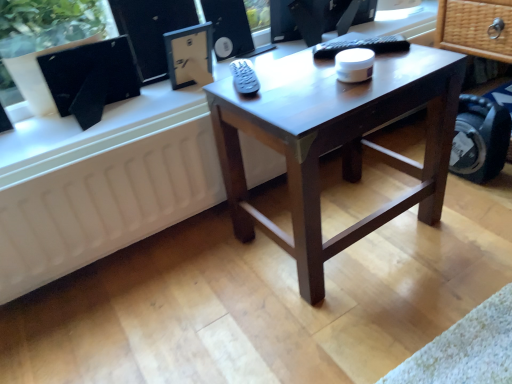
The height and width of the screenshot is (384, 512). What do you see at coordinates (338, 146) in the screenshot?
I see `matte dark brown coffee table at center` at bounding box center [338, 146].

The width and height of the screenshot is (512, 384). What do you see at coordinates (229, 28) in the screenshot? I see `matte black speaker at upper center` at bounding box center [229, 28].

The height and width of the screenshot is (384, 512). What do you see at coordinates (90, 78) in the screenshot?
I see `black matte computer monitor at upper left` at bounding box center [90, 78].

Identify the location of white matte radiator at lower left. (105, 203).

Looking at this image, could you measure the distance between black matte computer monitor at upper left and matte black speaker at upper center?

black matte computer monitor at upper left is 15.42 inches away from matte black speaker at upper center.

Between black matte computer monitor at upper left and matte black speaker at upper center, which one has smaller width?

With smaller width is matte black speaker at upper center.

Locate an element on the screen. This screenshot has width=512, height=384. speaker behind the black matte computer monitor at upper left is located at coordinates (229, 28).

Which of these two, black matte computer monitor at upper left or matte black speaker at upper center, stands shorter?

With less height is black matte computer monitor at upper left.

Is matte black speaker at upper center positioned with its back to matte dark brown coffee table at center?

That's not correct — matte black speaker at upper center is not looking away from matte dark brown coffee table at center.

Between matte black speaker at upper center and matte dark brown coffee table at center, which one has larger size?

With larger size is matte dark brown coffee table at center.

Would you consider matte black speaker at upper center to be distant from matte dark brown coffee table at center?

matte black speaker at upper center is near matte dark brown coffee table at center, not far away.

Does matte black speaker at upper center appear on the right side of matte dark brown coffee table at center?

In fact, matte black speaker at upper center is to the left of matte dark brown coffee table at center.

Which is behind, point (89, 175) or point (105, 61)?

The point (105, 61) is farther.

From a real-world perspective, is white matte radiator at lower left positioned above or below black matte computer monitor at upper left?

From a real-world perspective, white matte radiator at lower left is physically below black matte computer monitor at upper left.

You are a GUI agent. You are given a task and a screenshot of the screen. Output one action in this format:
    pyautogui.click(x=<x>, y=<y>)
    Task: Click on the radiator in front of the black matte computer monitor at upper left
    This screenshot has width=512, height=384.
    Given the screenshot: What is the action you would take?
    pyautogui.click(x=105, y=203)

Which of these two, white matte radiator at lower left or black matte computer monitor at upper left, stands shorter?

black matte computer monitor at upper left is shorter.

In the image, is matte dark brown coffee table at center positioned in front of or behind white matte radiator at lower left?

matte dark brown coffee table at center is positioned closer to the viewer than white matte radiator at lower left.

Is matte dark brown coffee table at center aimed at white matte radiator at lower left?

No, matte dark brown coffee table at center is not oriented towards white matte radiator at lower left.

Is matte dark brown coffee table at center wider than white matte radiator at lower left?

Indeed, matte dark brown coffee table at center has a greater width compared to white matte radiator at lower left.

Considering the relative sizes of matte dark brown coffee table at center and white matte radiator at lower left in the image provided, is matte dark brown coffee table at center bigger than white matte radiator at lower left?

Yes.

Is white matte radiator at lower left not close to matte black speaker at upper center?

That's not correct — white matte radiator at lower left is a little close to matte black speaker at upper center.

Considering the sizes of objects white matte radiator at lower left and matte black speaker at upper center in the image provided, who is wider, white matte radiator at lower left or matte black speaker at upper center?

matte black speaker at upper center.

Can you confirm if white matte radiator at lower left is taller than matte black speaker at upper center?

Correct, white matte radiator at lower left is much taller as matte black speaker at upper center.

Which is closer to the camera, (14, 246) or (207, 16)?

Point (14, 246).

Which is closer to the camera, (244, 21) or (200, 144)?

Clearly, point (244, 21) is more distant from the camera than point (200, 144).

Is matte black speaker at upper center surrounding white matte radiator at lower left?

No.

Measure the distance from matte black speaker at upper center to white matte radiator at lower left.

The distance of matte black speaker at upper center from white matte radiator at lower left is 53.90 centimeters.

From a real-world perspective, is matte black speaker at upper center physically below white matte radiator at lower left?

No, from a real-world perspective, matte black speaker at upper center is not under white matte radiator at lower left.

Is the depth of black matte computer monitor at upper left greater than that of white matte radiator at lower left?

Yes, black matte computer monitor at upper left is behind white matte radiator at lower left.

At what (x,y) coordinates should I click in order to perform the action: click on computer monitor located above the white matte radiator at lower left (from a real-world perspective). Please return your answer as a coordinate pair (x, y). This screenshot has width=512, height=384. Looking at the image, I should click on (90, 78).

Are black matte computer monitor at upper left and white matte radiator at lower left beside each other?

No, black matte computer monitor at upper left is not next to white matte radiator at lower left.

From the picture: Considering the relative positions of black matte computer monitor at upper left and white matte radiator at lower left in the image provided, is black matte computer monitor at upper left to the left or to the right of white matte radiator at lower left?

Clearly, black matte computer monitor at upper left is on the left of white matte radiator at lower left in the image.

The height and width of the screenshot is (384, 512). Identify the location of speaker above the black matte computer monitor at upper left (from the image's perspective). (229, 28).

Image resolution: width=512 pixels, height=384 pixels. Find the location of `speaker above the matte dark brown coffee table at center (from a real-world perspective)`. speaker above the matte dark brown coffee table at center (from a real-world perspective) is located at coordinates (229, 28).

Looking at the image, which one is located closer to white matte radiator at lower left, black matte computer monitor at upper left or matte black speaker at upper center?

Based on the image, black matte computer monitor at upper left appears to be nearer to white matte radiator at lower left.

Which object lies further to the anchor point matte dark brown coffee table at center, black matte computer monitor at upper left or white matte radiator at lower left?

black matte computer monitor at upper left is further to matte dark brown coffee table at center.

Which object lies further to the anchor point black matte computer monitor at upper left, white matte radiator at lower left or matte black speaker at upper center?

Among the two, matte black speaker at upper center is located further to black matte computer monitor at upper left.

From the image, which object appears to be farther from white matte radiator at lower left, black matte computer monitor at upper left or matte dark brown coffee table at center?

Among the two, matte dark brown coffee table at center is located further to white matte radiator at lower left.

Considering their positions, is black matte computer monitor at upper left positioned further to matte black speaker at upper center than matte dark brown coffee table at center?

Based on the image, matte dark brown coffee table at center appears to be further to matte black speaker at upper center.

Considering their positions, is matte dark brown coffee table at center positioned further to white matte radiator at lower left than black matte computer monitor at upper left?

Based on the image, matte dark brown coffee table at center appears to be further to white matte radiator at lower left.

Estimate the real-world distances between objects in this image. Which object is further from matte dark brown coffee table at center, matte black speaker at upper center or white matte radiator at lower left?

matte black speaker at upper center.

From the image, which object appears to be farther from matte black speaker at upper center, matte dark brown coffee table at center or black matte computer monitor at upper left?

Based on the image, matte dark brown coffee table at center appears to be further to matte black speaker at upper center.

Where is `radiator between black matte computer monitor at upper left and matte dark brown coffee table at center from left to right`? radiator between black matte computer monitor at upper left and matte dark brown coffee table at center from left to right is located at coordinates (105, 203).

Find the location of a particular element. This screenshot has width=512, height=384. coffee table that lies between matte black speaker at upper center and white matte radiator at lower left from top to bottom is located at coordinates (338, 146).

Identify the location of computer monitor that lies between matte black speaker at upper center and white matte radiator at lower left from top to bottom. point(90,78).

Find the location of a particular element. This screenshot has width=512, height=384. speaker located between black matte computer monitor at upper left and matte dark brown coffee table at center in the left-right direction is located at coordinates coord(229,28).